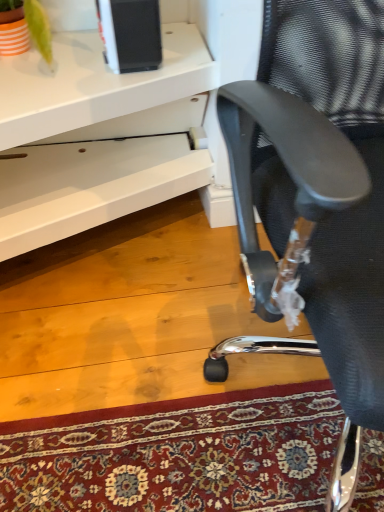
Locate an element on the screen. The image size is (384, 512). black mesh chair at right is located at coordinates (319, 193).

This screenshot has width=384, height=512. What do you see at coordinates (319, 193) in the screenshot?
I see `black mesh chair at right` at bounding box center [319, 193].

Where is `white glossy desk at center`? This screenshot has width=384, height=512. white glossy desk at center is located at coordinates (97, 136).

What is the approximate height of white glossy desk at center?

white glossy desk at center is 36.31 centimeters tall.

The image size is (384, 512). What do you see at coordinates (97, 136) in the screenshot?
I see `white glossy desk at center` at bounding box center [97, 136].

Locate an element on the screen. black mesh chair at right is located at coordinates (319, 193).

Can you confirm if black mesh chair at right is positioned to the left of white glossy desk at center?

Incorrect, black mesh chair at right is not on the left side of white glossy desk at center.

Considering their positions, is black mesh chair at right located in front of or behind white glossy desk at center?

Clearly, black mesh chair at right is in front of white glossy desk at center.

Is point (301, 86) closer to camera compared to point (183, 170)?

That is True.

From the image's perspective, would you say black mesh chair at right is positioned over white glossy desk at center?

No, from the image's perspective, black mesh chair at right is not over white glossy desk at center.

From a real-world perspective, which object stands above the other?

black mesh chair at right is physically above.

Can you confirm if black mesh chair at right is thinner than white glossy desk at center?

Correct, the width of black mesh chair at right is less than that of white glossy desk at center.

Does black mesh chair at right have a greater height compared to white glossy desk at center?

Yes, black mesh chair at right is taller than white glossy desk at center.

Can you confirm if black mesh chair at right is bigger than white glossy desk at center?

Indeed, black mesh chair at right has a larger size compared to white glossy desk at center.

Is black mesh chair at right outside of white glossy desk at center?

black mesh chair at right is positioned outside white glossy desk at center.

Can you see black mesh chair at right touching white glossy desk at center?

No, black mesh chair at right is not with white glossy desk at center.

Is black mesh chair at right aimed at white glossy desk at center?

No, black mesh chair at right is not facing towards white glossy desk at center.

In the scene shown: Can you tell me how much black mesh chair at right and white glossy desk at center differ in facing direction?

The angle between the facing direction of black mesh chair at right and the facing direction of white glossy desk at center is 0.000706 degrees.

Where is `chair in front of the white glossy desk at center`? The width and height of the screenshot is (384, 512). chair in front of the white glossy desk at center is located at coordinates (319, 193).

Considering the positions of objects white glossy desk at center and black mesh chair at right in the image provided, who is more to the left, white glossy desk at center or black mesh chair at right?

Positioned to the left is white glossy desk at center.

Who is more distant, white glossy desk at center or black mesh chair at right?

white glossy desk at center is further away from the camera.

Is point (195, 172) farther from viewer compared to point (334, 271)?

Yes, point (195, 172) is farther from viewer.

Based on the photo, from the image's perspective, is white glossy desk at center under black mesh chair at right?

No.

From a real-world perspective, does white glossy desk at center stand above black mesh chair at right?

No, from a real-world perspective, white glossy desk at center is not over black mesh chair at right

Considering the sizes of white glossy desk at center and black mesh chair at right in the image, is white glossy desk at center wider or thinner than black mesh chair at right?

Clearly, white glossy desk at center has more width compared to black mesh chair at right.

Considering the relative sizes of white glossy desk at center and black mesh chair at right in the image provided, is white glossy desk at center shorter than black mesh chair at right?

Yes, white glossy desk at center is shorter than black mesh chair at right.

Is white glossy desk at center smaller than black mesh chair at right?

Correct, white glossy desk at center occupies less space than black mesh chair at right.

Can we say white glossy desk at center lies outside black mesh chair at right?

white glossy desk at center lies outside black mesh chair at right's area.

Can you see white glossy desk at center touching black mesh chair at right?

No.

Does white glossy desk at center turn towards black mesh chair at right?

No, white glossy desk at center does not turn towards black mesh chair at right.

Where is `desk above the black mesh chair at right (from the image's perspective)`? The width and height of the screenshot is (384, 512). desk above the black mesh chair at right (from the image's perspective) is located at coordinates (97, 136).

This screenshot has width=384, height=512. In order to click on chair on the right of white glossy desk at center in this screenshot , I will do `click(319, 193)`.

The image size is (384, 512). In order to click on desk located underneath the black mesh chair at right (from a real-world perspective) in this screenshot , I will do `click(97, 136)`.